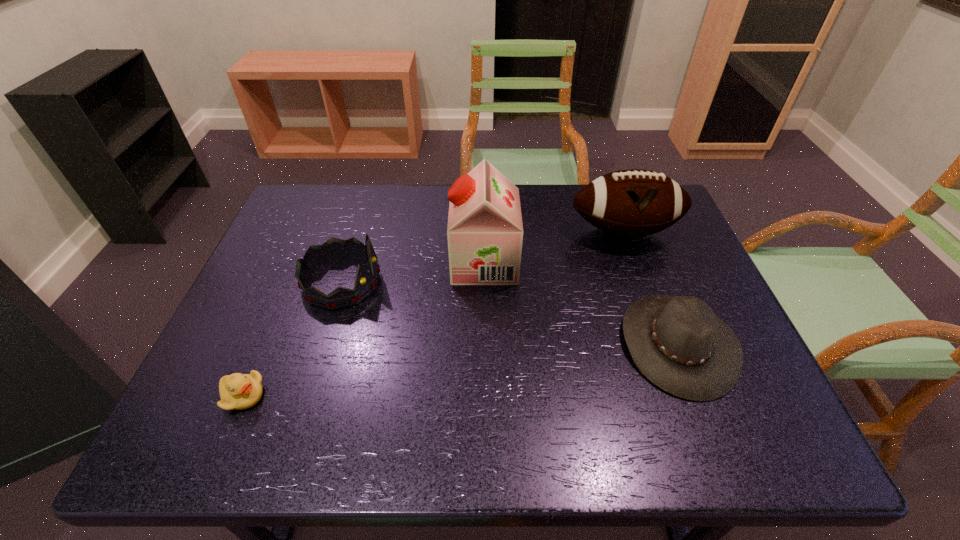
Where is `the tallest object`? This screenshot has height=540, width=960. the tallest object is located at coordinates pos(485,232).

At what (x,y) coordinates should I click in order to perform the action: click on the third object from right to left. Please return your answer as a coordinate pair (x, y). The height and width of the screenshot is (540, 960). Looking at the image, I should click on (485, 232).

Locate an element on the screen. football (American) is located at coordinates (630, 203).

Image resolution: width=960 pixels, height=540 pixels. Identify the location of tiara. (333, 249).

This screenshot has height=540, width=960. What are the coordinates of `the fourth tallest object` in the screenshot? It's located at (678, 343).

Find the location of a particular element. the shortest object is located at coordinates (238, 391).

Locate an element on the screen. The height and width of the screenshot is (540, 960). free space located with the cap open on the soya milk is located at coordinates (309, 262).

Locate an element on the screen. The width and height of the screenshot is (960, 540). vacant space positioned with the cap open on the soya milk is located at coordinates (404, 262).

You are a GUI agent. You are given a task and a screenshot of the screen. Output one action in this format:
    pyautogui.click(x=<x>, y=<y>)
    Task: Click on the vacant area situated 0.310m with the cap open on the soya milk
    This screenshot has width=960, height=540.
    Given the screenshot: What is the action you would take?
    pyautogui.click(x=338, y=262)

The width and height of the screenshot is (960, 540). I want to click on vacant space located 0.080m on the back of the second tallest object, so click(x=612, y=196).